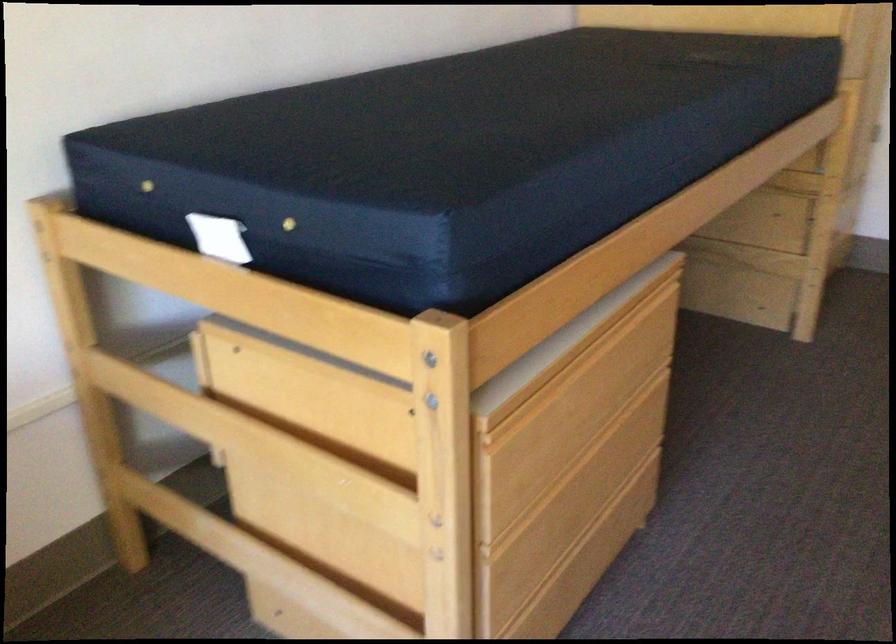
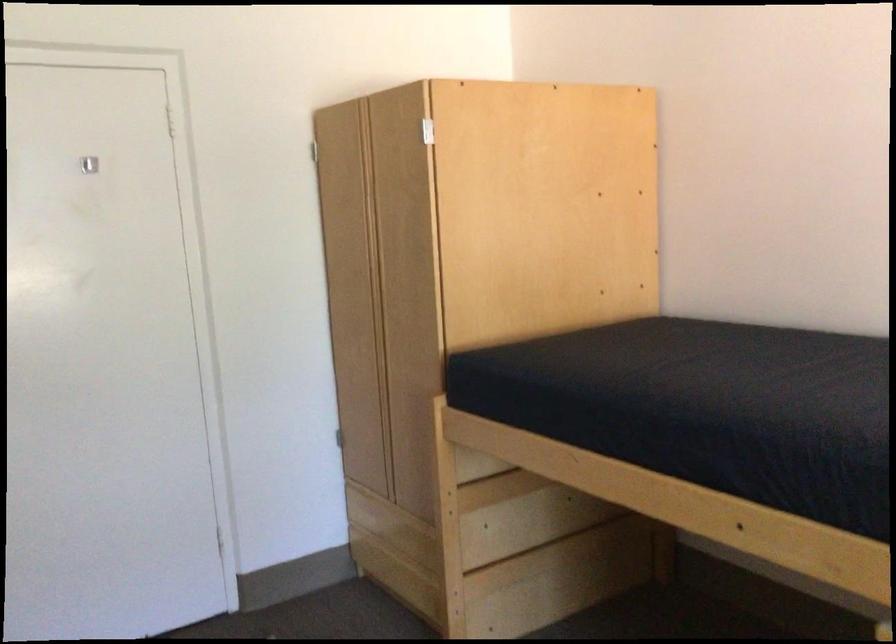
Question: Based on the continuous images, in which direction is the camera rotating? Reply with the corresponding letter.

Choices:
 (A) Left
 (B) Right
 (C) Up
 (D) Down

Answer: (B)